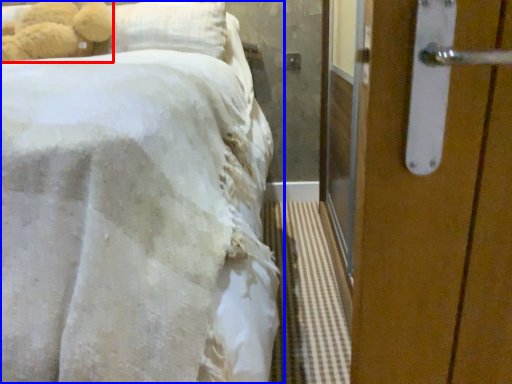
Question: Among these objects, which one is farthest to the camera, teddy bear (highlighted by a red box) or bed (highlighted by a blue box)?

Choices:
 (A) teddy bear
 (B) bed

Answer: (A)